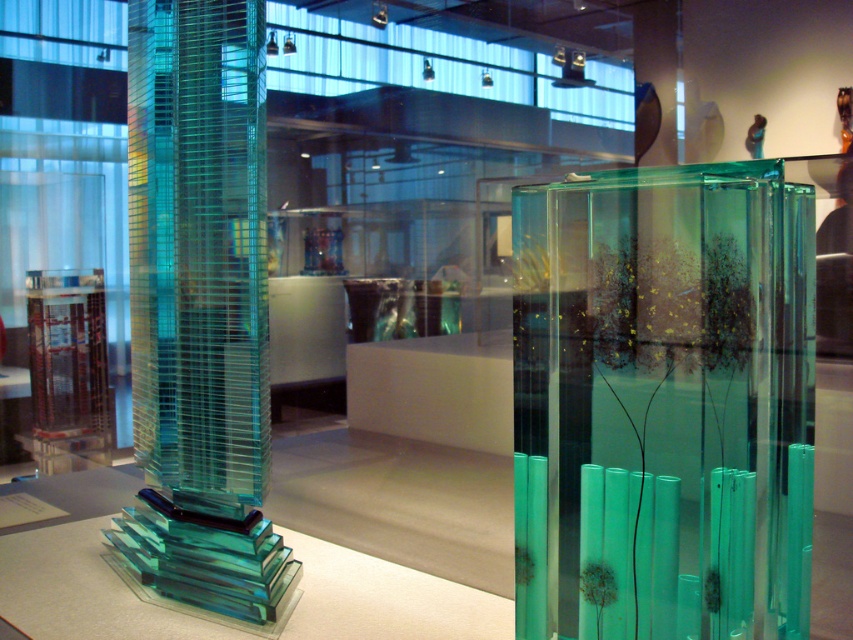
You are a visitor at the exhibition and want to take a photo of the translucent glass tower at left without any obstruction. Is the transparent glass table at center blocking your view of the tower?

The translucent glass tower at left is positioned over the transparent glass table at center, so the table is directly beneath the tower. Since the table is transparent, it won not block your view of the tower.

You are an art curator planning to move the transparent glass sculpture at right and the translucent glass tower at left to a new gallery layout. If you want to keep their original relative positions, which sculpture should be placed to the right of the other?

The transparent glass sculpture at right should be placed to the right of the translucent glass tower at left, as it was originally positioned on the right side of the translucent glass tower at left.

You are standing in the exhibition space and want to take a closer look at the glass sculptures. If you move forward by 0.5 meters towards the point at coordinates point (515, 467), how far will you be from that point?

After moving forward 0.5 meters towards point (515, 467), you will be 0.87 meters away from it.